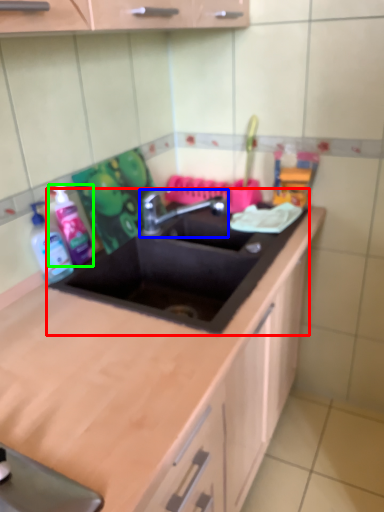
Question: Based on their relative distances, which object is farther from sink (highlighted by a red box)? Choose from tap (highlighted by a blue box) and cleaning product (highlighted by a green box).

Choices:
 (A) tap
 (B) cleaning product

Answer: (B)